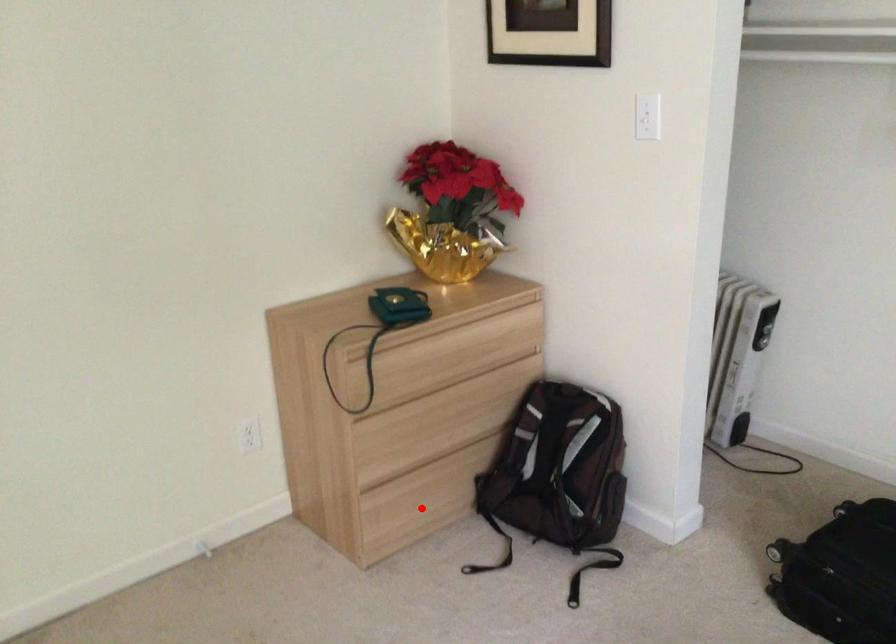
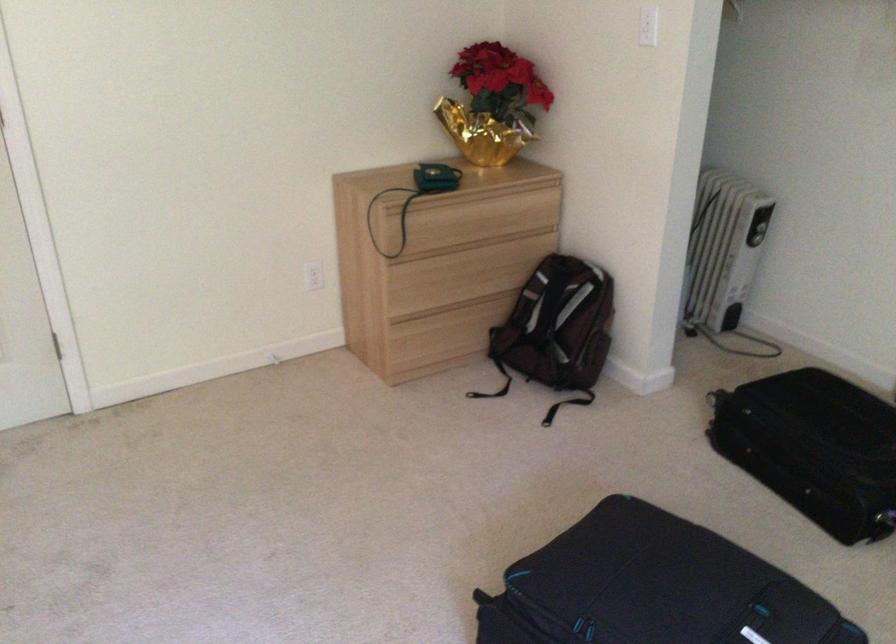
Question: I am providing you with two images of the same scene from different viewpoints. A red point is marked on the first image. Can you still see the location of the red point in image 2?

Choices:
 (A) Yes
 (B) No

Answer: (A)